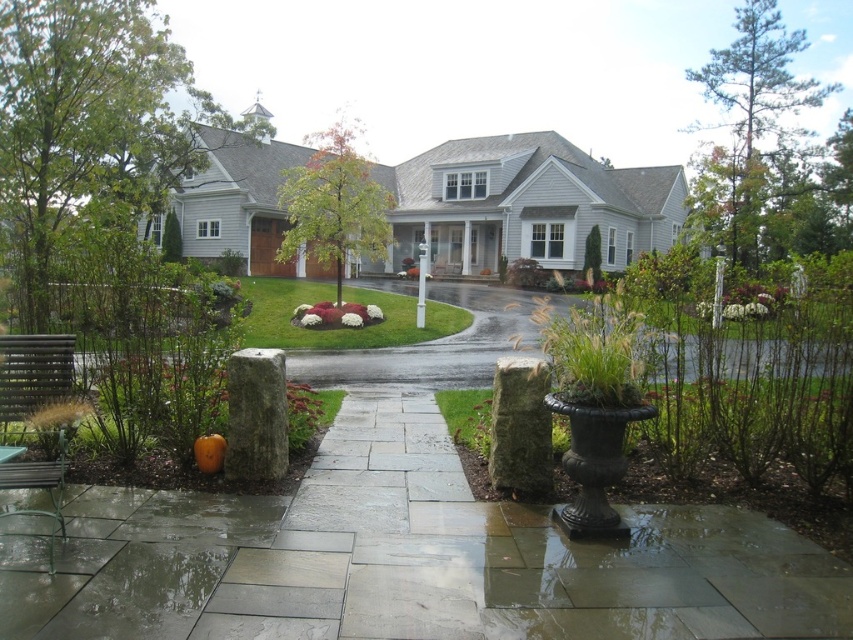
Is gray siding house at center to the right of green grass at center from the viewer's perspective?

No, gray siding house at center is not to the right of green grass at center.

Locate an element on the screen. gray siding house at center is located at coordinates (524, 205).

Between green mossy stone pillar at center and gray stone pillar at center-left, which one is positioned lower?

green mossy stone pillar at center

What do you see at coordinates (520, 428) in the screenshot?
I see `green mossy stone pillar at center` at bounding box center [520, 428].

Locate an element on the screen. This screenshot has height=640, width=853. green mossy stone pillar at center is located at coordinates (520, 428).

Who is more forward, (x=480, y=266) or (x=236, y=390)?

Positioned in front is point (x=236, y=390).

Who is positioned more to the right, gray siding house at center or gray stone pillar at center-left?

gray siding house at center

Where is `gray siding house at center`? gray siding house at center is located at coordinates (524, 205).

Identify the location of gray siding house at center. This screenshot has height=640, width=853. (524, 205).